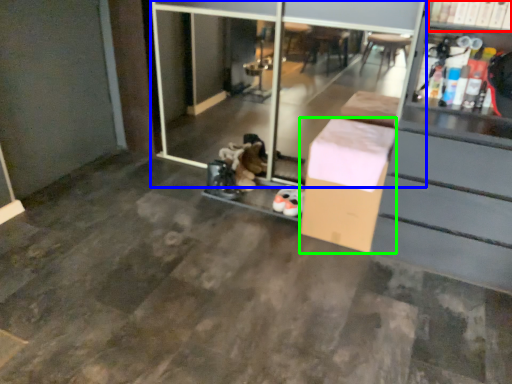
Question: Considering the real-world distances, which object is farthest from shelf (highlighted by a red box)? screen door (highlighted by a blue box) or box (highlighted by a green box)?

Choices:
 (A) screen door
 (B) box

Answer: (A)